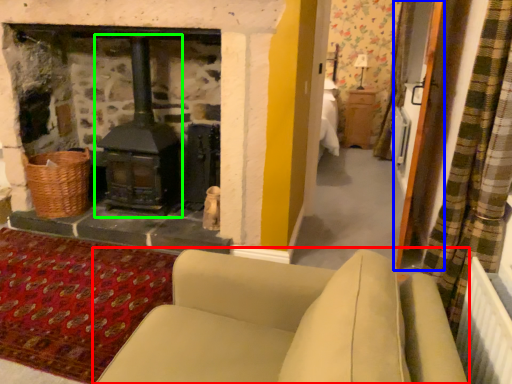
Question: Based on their relative distances, which object is nearer to studio couch (highlighted by a red box)? Choose from screen door (highlighted by a blue box) and wood burning stove (highlighted by a green box).

Choices:
 (A) screen door
 (B) wood burning stove

Answer: (A)